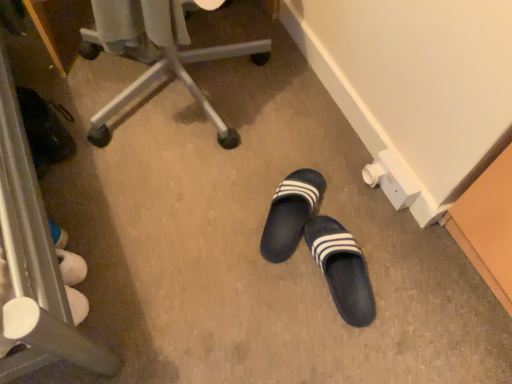
Question: From the image's perspective, is matte plastic chair at upper center above or below black rubber slippers at center, the 1th footwear when ordered from left to right?

Choices:
 (A) above
 (B) below

Answer: (A)

Question: Is matte plastic chair at upper center wider or thinner than black rubber slippers at center, the second footwear in the right-to-left sequence?

Choices:
 (A) thin
 (B) wide

Answer: (B)

Question: Estimate the real-world distances between objects in this image. Which object is farther from the matte plastic chair at upper center?

Choices:
 (A) black rubber slippers at center, the second footwear in the right-to-left sequence
 (B) black rubber slippers at center, the 2th footwear positioned from the left

Answer: (B)

Question: Which object is the closest to the matte plastic chair at upper center?

Choices:
 (A) black rubber slippers at center, the 2th footwear positioned from the left
 (B) black rubber slippers at center, the 1th footwear when ordered from left to right

Answer: (B)